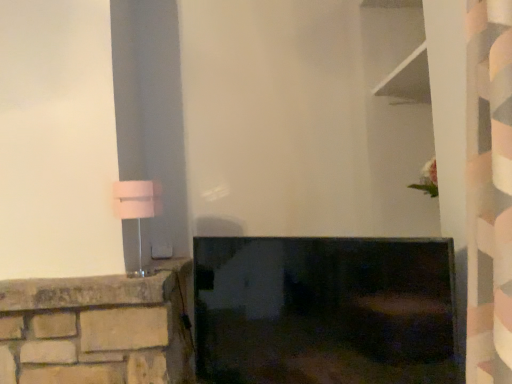
The width and height of the screenshot is (512, 384). I want to click on pink fabric lampshade at left, so click(x=137, y=221).

Describe the element at coordinates (137, 221) in the screenshot. The image size is (512, 384). I see `pink fabric lampshade at left` at that location.

Describe the element at coordinates (325, 310) in the screenshot. I see `matte black tv at center` at that location.

Locate an element on the screen. matte black tv at center is located at coordinates (325, 310).

Image resolution: width=512 pixels, height=384 pixels. Identify the location of pink fabric lampshade at left. (137, 221).

Considering the positions of objects pink fabric lampshade at left and matte black tv at center in the image provided, who is more to the left, pink fabric lampshade at left or matte black tv at center?

From the viewer's perspective, pink fabric lampshade at left appears more on the left side.

Which object is further away from the camera, pink fabric lampshade at left or matte black tv at center?

pink fabric lampshade at left is more distant.

Is point (157, 213) positioned after point (255, 369)?

Yes, point (157, 213) is behind point (255, 369).

From the image's perspective, which is below, pink fabric lampshade at left or matte black tv at center?

matte black tv at center.

From a real-world perspective, is pink fabric lampshade at left located beneath matte black tv at center?

Answer: No, from a real-world perspective, pink fabric lampshade at left is not beneath matte black tv at center.

Which of these two, pink fabric lampshade at left or matte black tv at center, is wider?

Wider between the two is pink fabric lampshade at left.

Considering the relative sizes of pink fabric lampshade at left and matte black tv at center in the image provided, is pink fabric lampshade at left shorter than matte black tv at center?

Correct, pink fabric lampshade at left is not as tall as matte black tv at center.

In terms of size, does pink fabric lampshade at left appear bigger or smaller than matte black tv at center?

pink fabric lampshade at left is smaller than matte black tv at center.

Would you say pink fabric lampshade at left is inside or outside matte black tv at center?

pink fabric lampshade at left lies outside matte black tv at center.

Can you see pink fabric lampshade at left touching matte black tv at center?

No, pink fabric lampshade at left is not making contact with matte black tv at center.

Is pink fabric lampshade at left aimed at matte black tv at center?

No.

You are a GUI agent. You are given a task and a screenshot of the screen. Output one action in this format:
    pyautogui.click(x=<x>, y=<y>)
    Task: Click on the table lamp lying behind the matte black tv at center
    This screenshot has width=512, height=384.
    Given the screenshot: What is the action you would take?
    pyautogui.click(x=137, y=221)

Considering the relative positions of matte black tv at center and pink fabric lampshade at left in the image provided, is matte black tv at center to the left or to the right of pink fabric lampshade at left?

From the image, it's evident that matte black tv at center is to the right of pink fabric lampshade at left.

Relative to pink fabric lampshade at left, is matte black tv at center in front or behind?

In the image, matte black tv at center appears in front of pink fabric lampshade at left.

Which point is more distant from viewer, (356, 268) or (149, 188)?

A: The point (149, 188) is farther from the camera.

From the image's perspective, which one is positioned lower, matte black tv at center or pink fabric lampshade at left?

matte black tv at center, from the image's perspective.

From a real-world perspective, is matte black tv at center positioned under pink fabric lampshade at left based on gravity?

Yes, from a real-world perspective, matte black tv at center is below pink fabric lampshade at left.

Can you confirm if matte black tv at center is wider than pink fabric lampshade at left?

No, matte black tv at center is not wider than pink fabric lampshade at left.

Considering the relative sizes of matte black tv at center and pink fabric lampshade at left in the image provided, is matte black tv at center taller than pink fabric lampshade at left?

Yes, matte black tv at center is taller than pink fabric lampshade at left.

Which of these two, matte black tv at center or pink fabric lampshade at left, is smaller?

pink fabric lampshade at left.

Is matte black tv at center completely or partially outside of pink fabric lampshade at left?

Yes, matte black tv at center is outside of pink fabric lampshade at left.

Is matte black tv at center positioned far away from pink fabric lampshade at left?

That's not correct — matte black tv at center is a little close to pink fabric lampshade at left.

Is matte black tv at center oriented towards pink fabric lampshade at left?

No, matte black tv at center is not oriented towards pink fabric lampshade at left.

Identify the location of table lamp above the matte black tv at center (from the image's perspective). This screenshot has height=384, width=512. [137, 221].

Where is `fireplace beneath the pink fabric lampshade at left (from a real-world perspective)`? fireplace beneath the pink fabric lampshade at left (from a real-world perspective) is located at coordinates (x=325, y=310).

Find the location of a particular element. This screenshot has height=384, width=512. fireplace lying on the right of pink fabric lampshade at left is located at coordinates click(x=325, y=310).